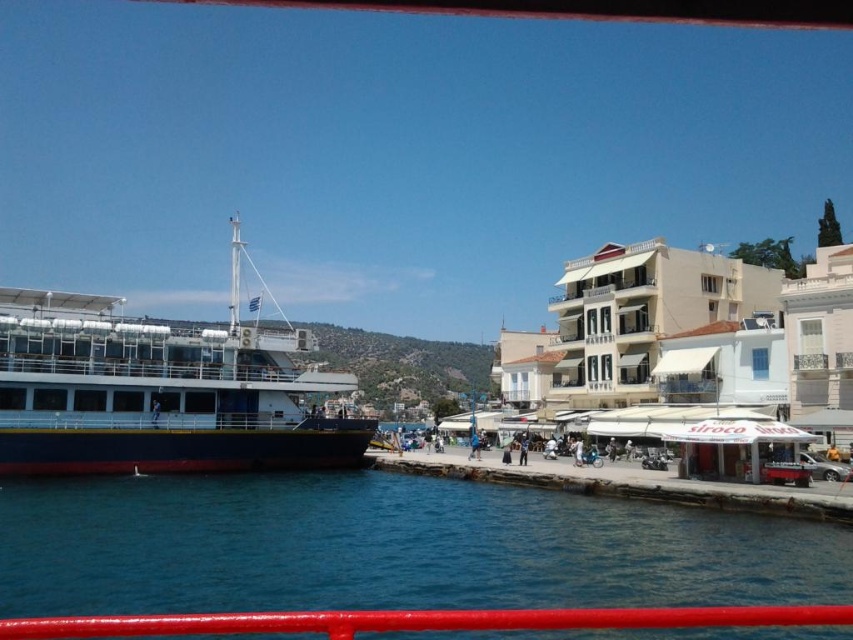
Question: Among these objects, which one is nearest to the camera?

Choices:
 (A) smooth glossy rail at lower center
 (B) blue water at lower left

Answer: (B)

Question: Which of the following is the closest to the observer?

Choices:
 (A) (76, 618)
 (B) (97, 380)
 (C) (469, 449)
 (D) (521, 433)

Answer: (A)

Question: Is blue water at lower left to the right of smooth glossy rail at lower center from the viewer's perspective?

Choices:
 (A) yes
 (B) no

Answer: (B)

Question: Does blue matte ship at left lie in front of smooth glossy rail at lower center?

Choices:
 (A) no
 (B) yes

Answer: (A)

Question: Which point is closer to the camera taking this photo?

Choices:
 (A) (96, 326)
 (B) (527, 442)

Answer: (A)

Question: Does blue matte ship at left appear on the right side of smooth glossy rail at lower center?

Choices:
 (A) no
 (B) yes

Answer: (A)